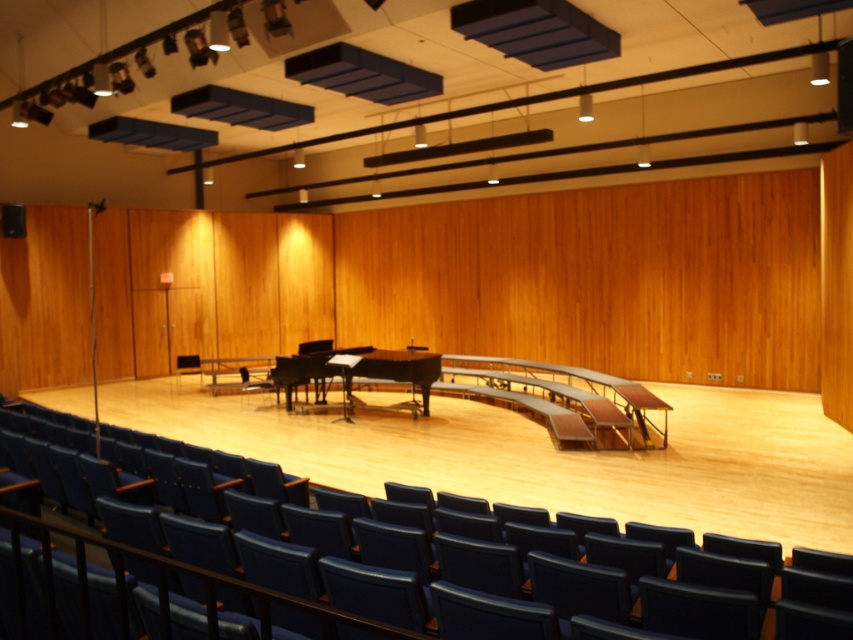
Is blue leather chair at center below shiny black piano at center?

Yes, blue leather chair at center is below shiny black piano at center.

Does point (213, 440) come closer to viewer compared to point (347, 374)?

Yes, point (213, 440) is closer to viewer.

Image resolution: width=853 pixels, height=640 pixels. What do you see at coordinates (550, 456) in the screenshot?
I see `blue leather chair at center` at bounding box center [550, 456].

The width and height of the screenshot is (853, 640). What are the coordinates of `blue leather chair at center` in the screenshot? It's located at (550, 456).

Is shiny black piano at center positioned behind dark blue fabric chair at center?

No, it is not.

Who is more distant from viewer, (283, 364) or (199, 381)?

Positioned behind is point (199, 381).

In order to click on shiny black piano at center in this screenshot , I will do `click(360, 369)`.

Between blue leather chair at center and dark blue fabric chair at center, which one appears on the right side from the viewer's perspective?

blue leather chair at center is more to the right.

Consider the image. Who is more forward, (x=292, y=445) or (x=183, y=365)?

Positioned in front is point (x=292, y=445).

Where is `blue leather chair at center`? blue leather chair at center is located at coordinates (550, 456).